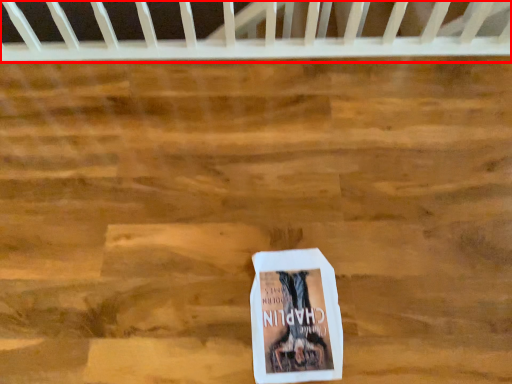
Question: From the image's perspective, what is the correct spatial positioning of infant bed (annotated by the red box) in reference to book?

Choices:
 (A) above
 (B) below

Answer: (A)